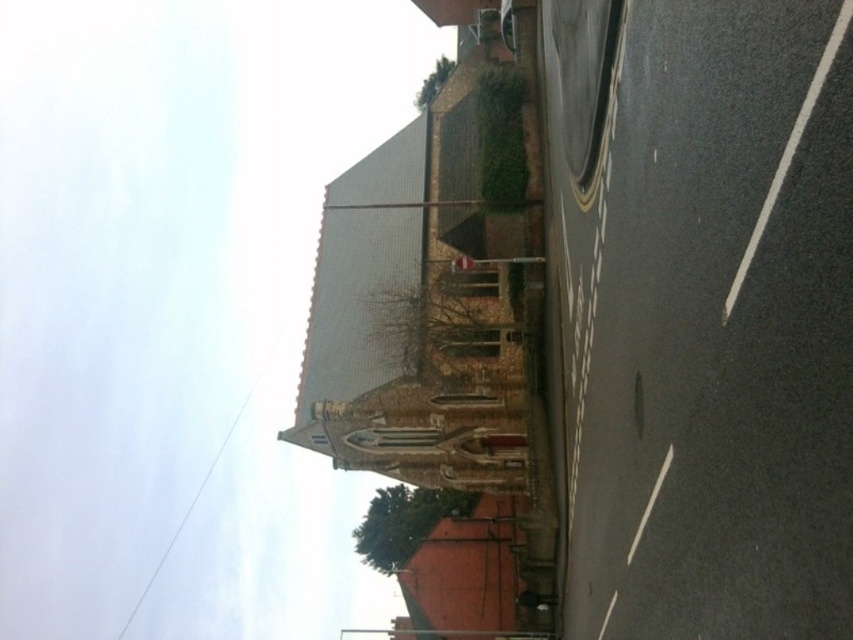
Question: Which point is closer to the camera?

Choices:
 (A) brown brick fire escape at center
 (B) black asphalt at lower right

Answer: (B)

Question: Observing the image, what is the correct spatial positioning of black asphalt at lower right in reference to brown brick fire escape at center?

Choices:
 (A) right
 (B) left

Answer: (A)

Question: Does black asphalt at lower right have a greater width compared to brown brick fire escape at center?

Choices:
 (A) no
 (B) yes

Answer: (A)

Question: Does black asphalt at lower right appear on the left side of brown brick fire escape at center?

Choices:
 (A) no
 (B) yes

Answer: (A)